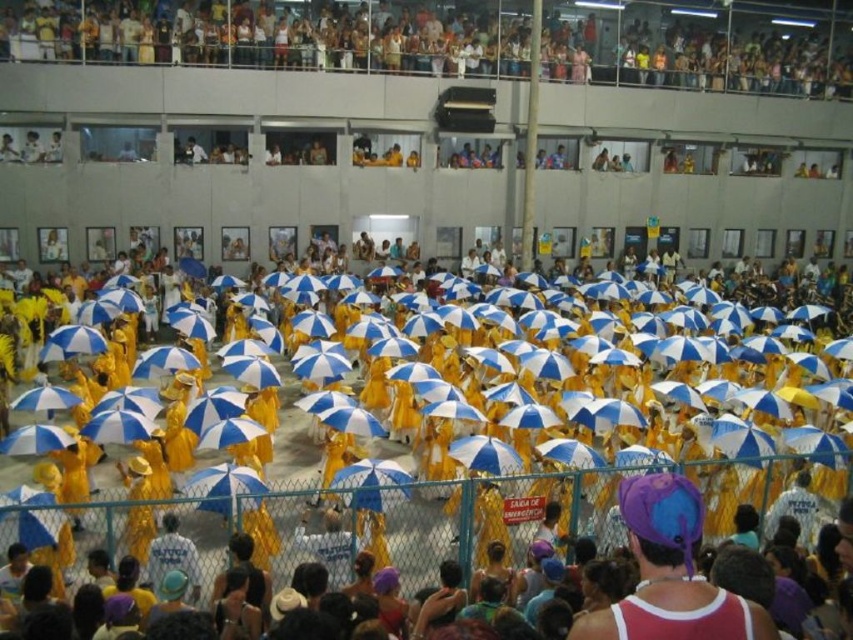
Question: Which point is farther to the camera?

Choices:
 (A) (677, 584)
 (B) (827, 49)

Answer: (B)

Question: Which point is closer to the camera taking this photo?

Choices:
 (A) (694, 544)
 (B) (357, 49)

Answer: (A)

Question: Can you confirm if yellow fabric umbrellas at upper center is positioned above purple fabric hat at center?

Choices:
 (A) yes
 (B) no

Answer: (A)

Question: Is yellow fabric umbrellas at upper center smaller than purple fabric hat at center?

Choices:
 (A) yes
 (B) no

Answer: (B)

Question: Is yellow fabric umbrellas at upper center above purple fabric hat at center?

Choices:
 (A) no
 (B) yes

Answer: (B)

Question: Which point is closer to the camera?

Choices:
 (A) (668, 497)
 (B) (540, 74)

Answer: (A)